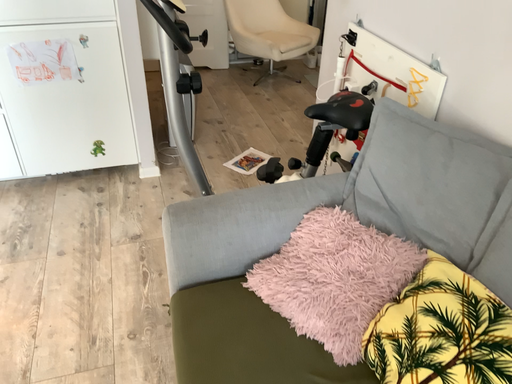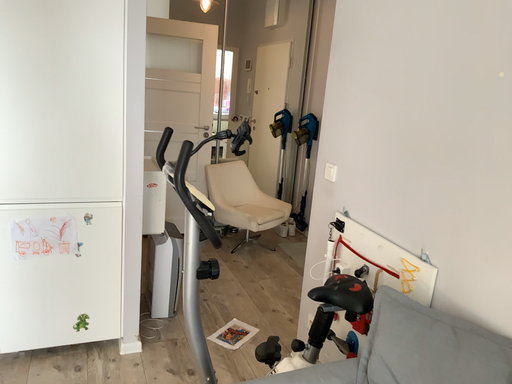
Question: Which way did the camera rotate in the video?

Choices:
 (A) rotated upward
 (B) rotated downward

Answer: (A)